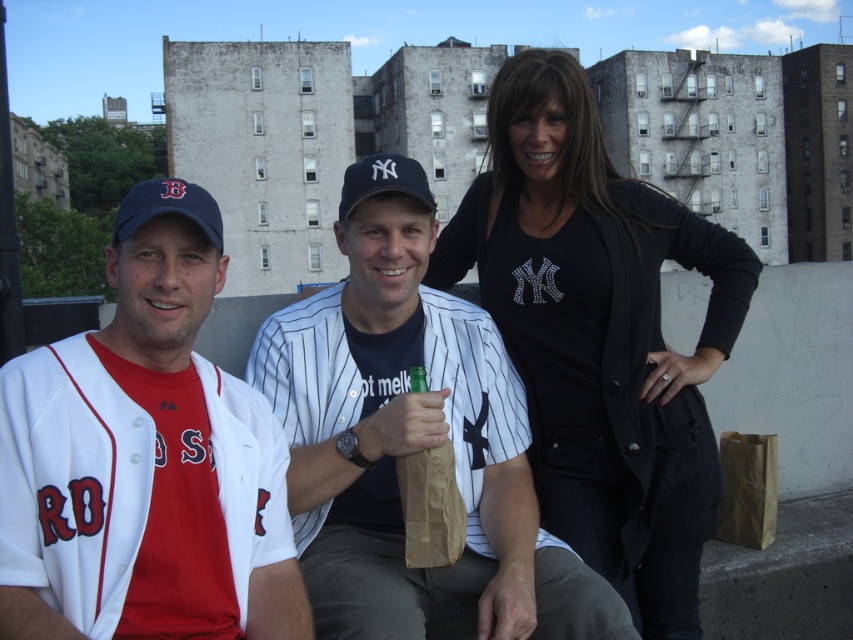
Question: Which point appears farthest from the camera in this image?

Choices:
 (A) (51, 422)
 (B) (618, 321)

Answer: (B)

Question: Estimate the real-world distances between objects in this image. Which object is farther from the black matte/black cardigan at upper right?

Choices:
 (A) white pinstriped jersey at center
 (B) brown paper bag at lower right

Answer: (B)

Question: Is black matte/black cardigan at upper right wider than white matte baseball jersey at center?

Choices:
 (A) yes
 (B) no

Answer: (A)

Question: Does white matte baseball jersey at center appear over brown paper bag at lower right?

Choices:
 (A) yes
 (B) no

Answer: (A)

Question: Is white pinstriped jersey at center smaller than brown paper bag at lower right?

Choices:
 (A) yes
 (B) no

Answer: (B)

Question: Among these points, which one is farthest from the camera?

Choices:
 (A) (206, 481)
 (B) (767, 518)
 (C) (708, 492)

Answer: (B)